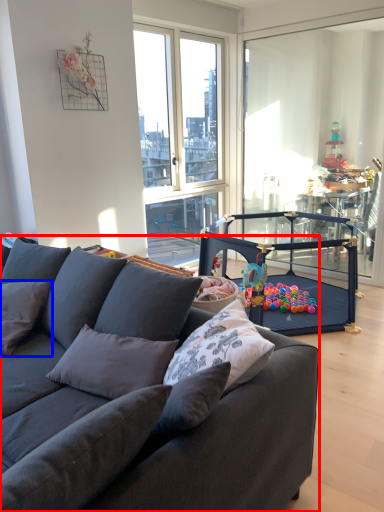
Question: Among these objects, which one is nearest to the camera, studio couch (highlighted by a red box) or pillow (highlighted by a blue box)?

Choices:
 (A) studio couch
 (B) pillow

Answer: (A)